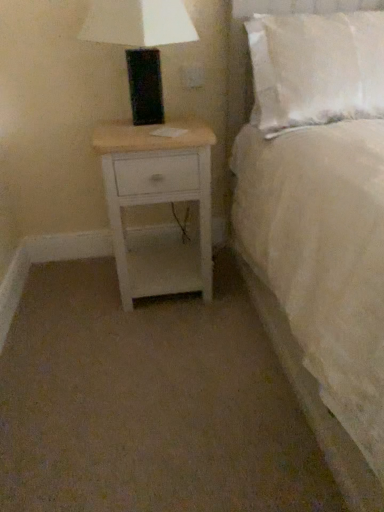
You are a GUI agent. You are given a task and a screenshot of the screen. Output one action in this format:
    pyautogui.click(x=<x>, y=<y>)
    Task: Click on the free space below matte black lamp at upper left (from a real-world perspective)
    Image resolution: width=384 pixels, height=512 pixels.
    Given the screenshot: What is the action you would take?
    pyautogui.click(x=156, y=125)